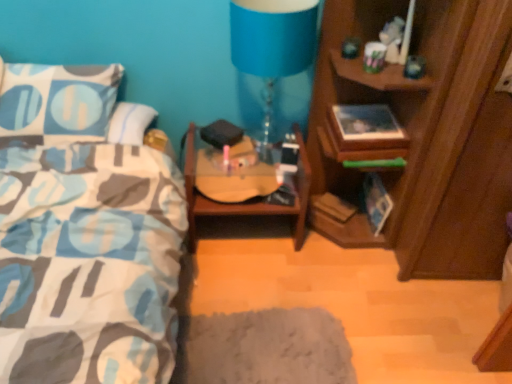
Question: Is wooden guitar case at center situated inside wooden cabinet at right or outside?

Choices:
 (A) outside
 (B) inside

Answer: (A)

Question: Is point (246, 210) positioned closer to the camera than point (415, 253)?

Choices:
 (A) closer
 (B) farther

Answer: (B)

Question: Which of these objects is positioned farthest from the wooden cabinet at right?

Choices:
 (A) wooden guitar case at center
 (B) blue fabric lampshade at upper center

Answer: (B)

Question: Estimate the real-world distances between objects in this image. Which object is closer to the blue fabric lampshade at upper center?

Choices:
 (A) wooden cabinet at right
 (B) wooden guitar case at center

Answer: (B)